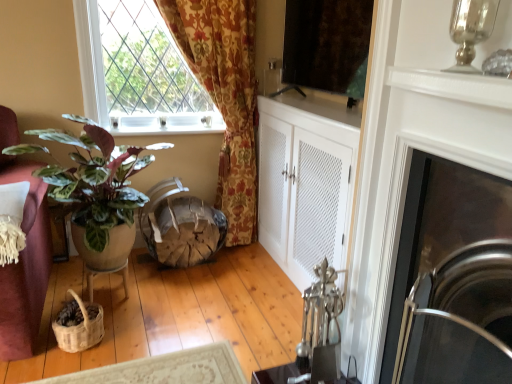
Question: Considering the relative sizes of matte black screen at upper center and wooden textured swivel chair at center in the image provided, is matte black screen at upper center wider than wooden textured swivel chair at center?

Choices:
 (A) no
 (B) yes

Answer: (A)

Question: Could you tell me if matte black screen at upper center is facing wooden textured swivel chair at center?

Choices:
 (A) yes
 (B) no

Answer: (B)

Question: Is wooden textured swivel chair at center inside matte black screen at upper center?

Choices:
 (A) yes
 (B) no

Answer: (B)

Question: Considering the relative sizes of matte black screen at upper center and wooden textured swivel chair at center in the image provided, is matte black screen at upper center shorter than wooden textured swivel chair at center?

Choices:
 (A) yes
 (B) no

Answer: (B)

Question: Considering the relative sizes of matte black screen at upper center and wooden textured swivel chair at center in the image provided, is matte black screen at upper center thinner than wooden textured swivel chair at center?

Choices:
 (A) no
 (B) yes

Answer: (B)

Question: Is matte black screen at upper center positioned before wooden textured swivel chair at center?

Choices:
 (A) no
 (B) yes

Answer: (B)

Question: Can you confirm if wooden textured swivel chair at center is smaller than matte terracotta pot at left?

Choices:
 (A) yes
 (B) no

Answer: (A)

Question: From a real-world perspective, is wooden textured swivel chair at center over matte terracotta pot at left?

Choices:
 (A) no
 (B) yes

Answer: (A)

Question: Can you confirm if wooden textured swivel chair at center is positioned to the left of matte terracotta pot at left?

Choices:
 (A) yes
 (B) no

Answer: (B)

Question: Can you confirm if wooden textured swivel chair at center is positioned to the right of matte terracotta pot at left?

Choices:
 (A) no
 (B) yes

Answer: (B)

Question: Does wooden textured swivel chair at center come behind matte terracotta pot at left?

Choices:
 (A) no
 (B) yes

Answer: (B)

Question: Is wooden textured swivel chair at center far from matte terracotta pot at left?

Choices:
 (A) no
 (B) yes

Answer: (A)

Question: Is polished stainless steel fireplace at right in contact with wooden table at lower left?

Choices:
 (A) yes
 (B) no

Answer: (B)